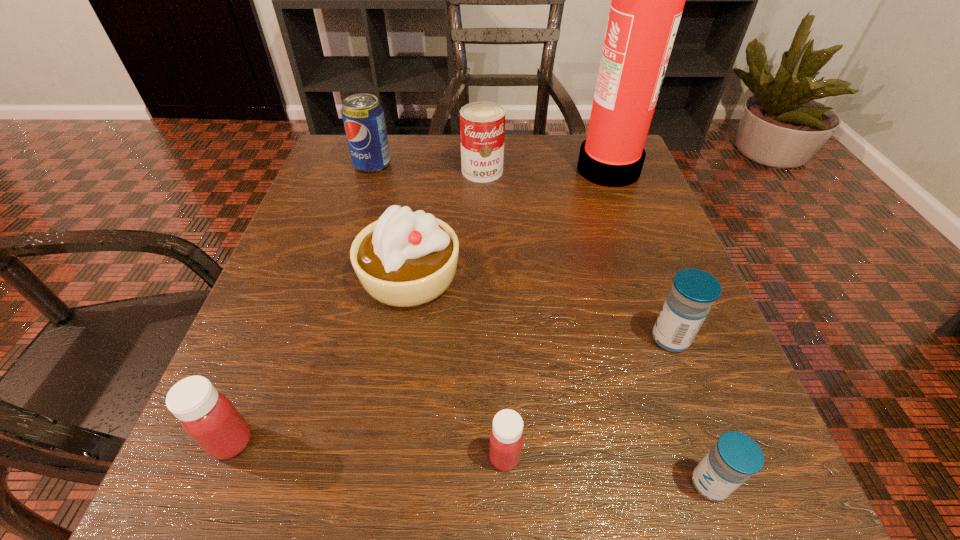
Where is `red fire extinguisher`? red fire extinguisher is located at coordinates (647, 2).

In order to click on fire extinguisher in this screenshot , I will do `click(647, 2)`.

Where is `soda`? The height and width of the screenshot is (540, 960). soda is located at coordinates click(363, 116).

Locate an element on the screen. can is located at coordinates (482, 124).

Image resolution: width=960 pixels, height=540 pixels. What are the coordinates of `the fourth farthest object` in the screenshot? It's located at (405, 258).

At what (x,y) coordinates should I click in order to perform the action: click on beige whipped cream. Please return your answer as a coordinate pair (x, y). This screenshot has height=540, width=960. Looking at the image, I should click on (405, 258).

Identify the location of the farther blue medicine. (694, 291).

Locate an element on the screen. This screenshot has height=540, width=960. the bigger blue medicine is located at coordinates (694, 291).

You are a GUI agent. You are given a task and a screenshot of the screen. Output one action in this format:
    pyautogui.click(x=<x>, y=<y>)
    Task: Click on the leftmost object
    
    Given the screenshot: What is the action you would take?
    pyautogui.click(x=208, y=417)

You are a GUI agent. You are given a task and a screenshot of the screen. Output one action in this format:
    pyautogui.click(x=<x>, y=<y>)
    Task: Click on the leftmost medicine
    This screenshot has height=540, width=960.
    Given the screenshot: What is the action you would take?
    pyautogui.click(x=208, y=417)